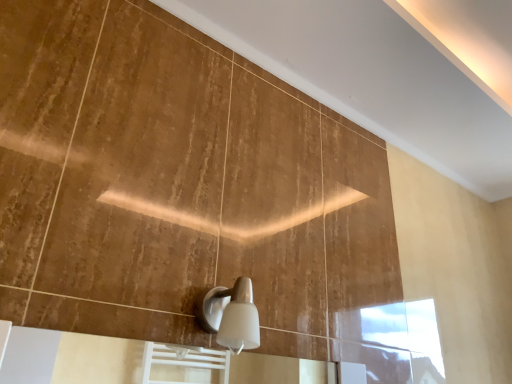
Describe the element at coordinates (231, 315) in the screenshot. The height and width of the screenshot is (384, 512). I see `white frosted glass light fixture at lower center` at that location.

Locate an element on the screen. This screenshot has height=384, width=512. white frosted glass light fixture at lower center is located at coordinates (231, 315).

Where is `white frosted glass light fixture at lower center`? white frosted glass light fixture at lower center is located at coordinates (231, 315).